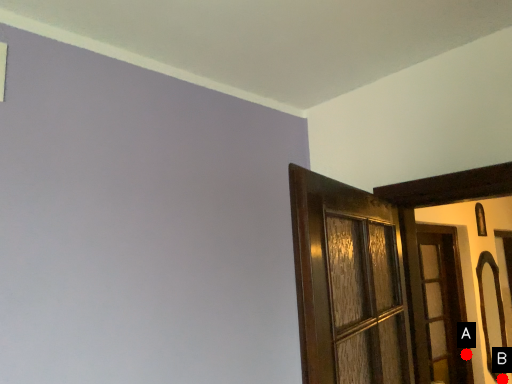
Question: Two points are circled on the image, labeled by A and B beside each circle. Which point is farther from the camera taking this photo?

Choices:
 (A) A is further
 (B) B is further

Answer: (B)